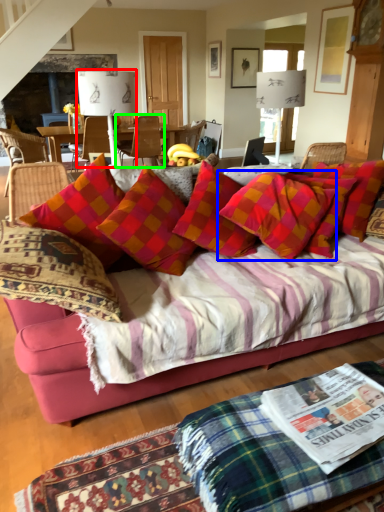
Question: Based on their relative distances, which object is farther from lamp (highlighted by a red box)? Choose from pillow (highlighted by a blue box) and chair (highlighted by a green box).

Choices:
 (A) pillow
 (B) chair

Answer: (B)